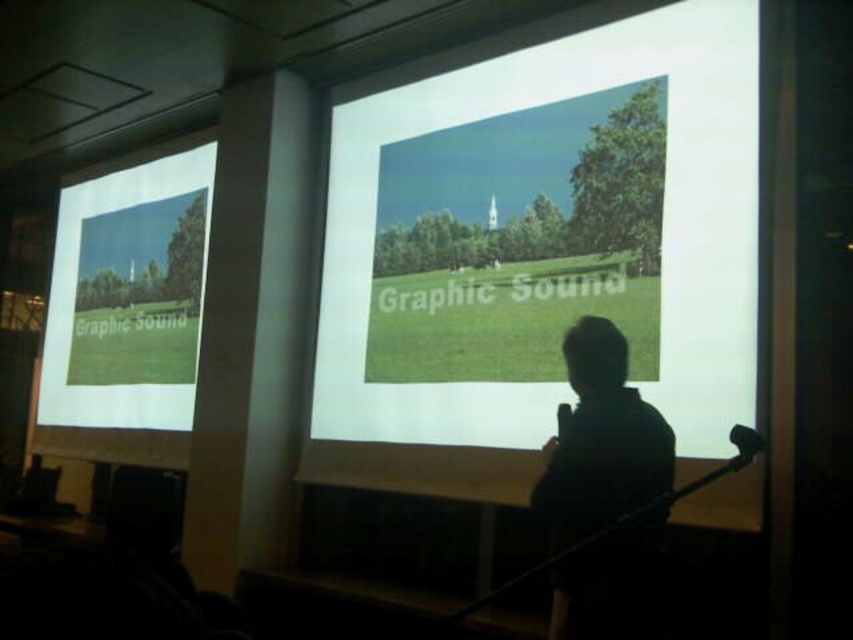
From the picture: You are sitting in the audience and see the silhouette human at center and the green grassy field at center in the presentation slide. Which object is positioned to the left of the other?

The green grassy field at center is to the left of the silhouette human at center.

You are sitting in the audience and want to see both the matte white screen at left and the silhouette human at center clearly. Which one is positioned to your left?

The matte white screen at left is positioned to the left of the silhouette human at center, so from your perspective in the audience, the matte white screen at left would be on your left side.